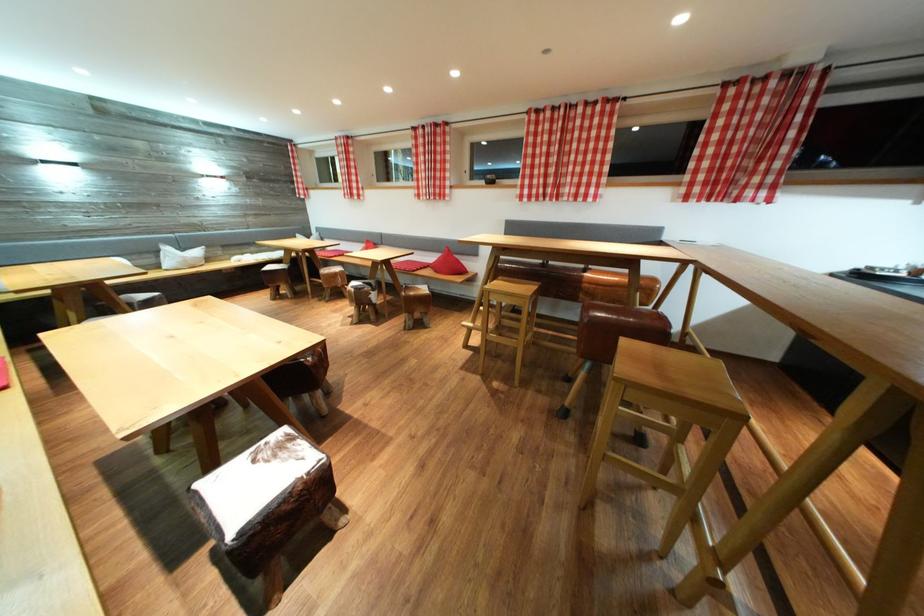
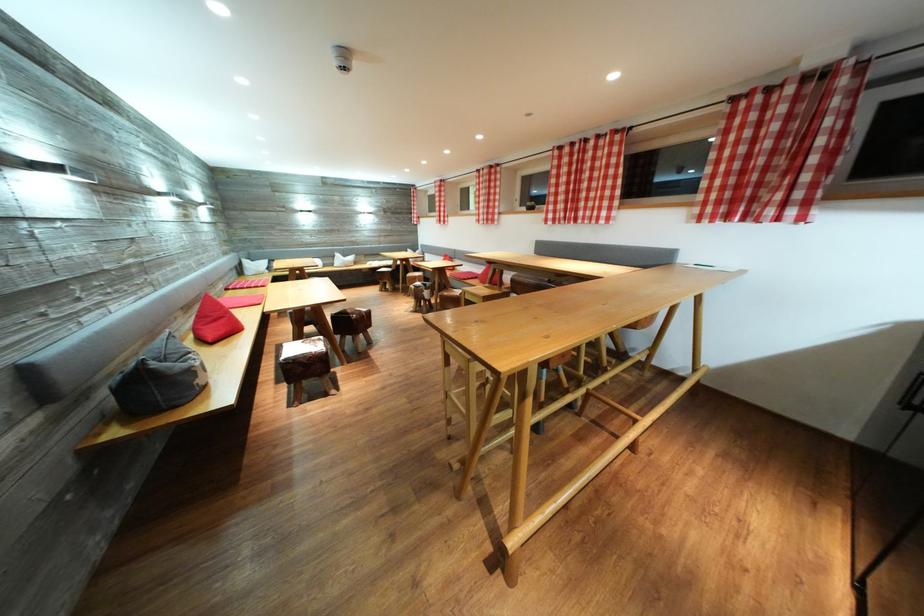
The point at (286, 293) is marked in the first image. Where is the corresponding point in the second image?

(393, 289)